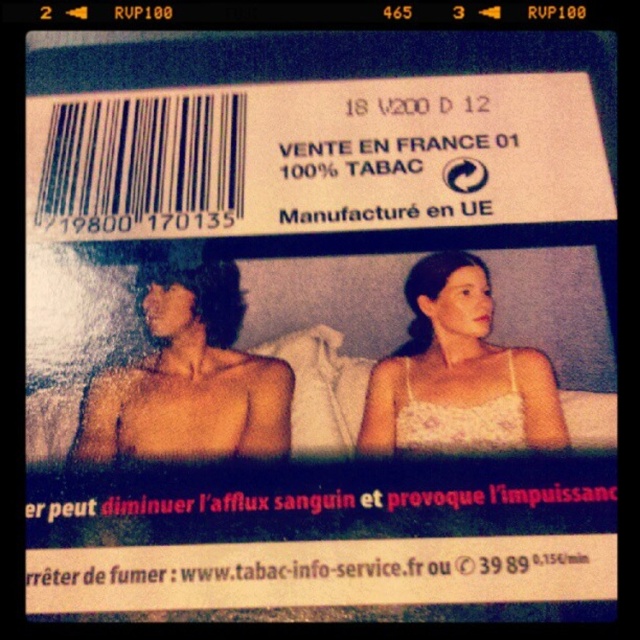
You are a delivery robot with a height of 1.5 meters. You need to navigate through a space where there is a point at coordinates (x=195, y=314). Can you safely pass through this area without hitting your head?

The distance between the point at (x=195, y=314) and the camera is 1.26 meters. Since the robot is 1.5 meters tall, it is taller than the available height, so it cannot safely pass through without hitting its head.

Based on the scene description, where is the shiny skin man at center located in terms of coordinates?

The shiny skin man at center is located at the coordinates point (188, 378).

You are observing the bottom section of an image where a shiny skin man at center and a white lace dress at center are present. Which object is closer to you?

The shiny skin man at center is closer to you as he is further to the viewer than the white lace dress at center.